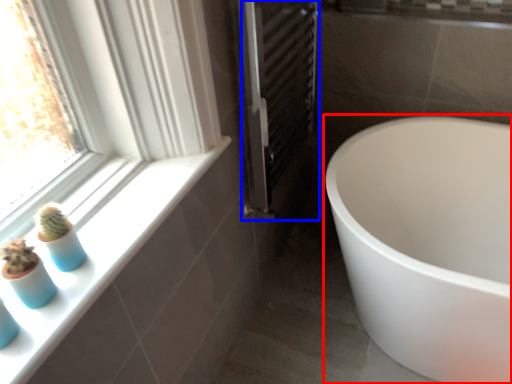
Question: Which object is further to the camera taking this photo, bathtub (highlighted by a red box) or screen door (highlighted by a blue box)?

Choices:
 (A) bathtub
 (B) screen door

Answer: (B)